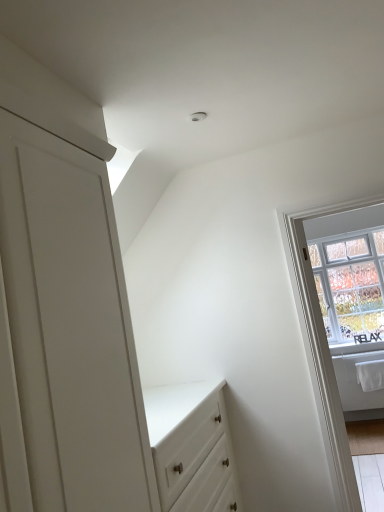
Question: Considering the relative sizes of white plastic window frame at right and clear glass window at upper right in the image provided, is white plastic window frame at right bigger than clear glass window at upper right?

Choices:
 (A) yes
 (B) no

Answer: (B)

Question: Considering the relative positions of white plastic window frame at right and clear glass window at upper right in the image provided, is white plastic window frame at right in front of clear glass window at upper right?

Choices:
 (A) no
 (B) yes

Answer: (B)

Question: Considering the relative sizes of white plastic window frame at right and clear glass window at upper right in the image provided, is white plastic window frame at right taller than clear glass window at upper right?

Choices:
 (A) yes
 (B) no

Answer: (A)

Question: Does white plastic window frame at right have a greater width compared to clear glass window at upper right?

Choices:
 (A) yes
 (B) no

Answer: (B)

Question: Is white plastic window frame at right to the left of clear glass window at upper right from the viewer's perspective?

Choices:
 (A) yes
 (B) no

Answer: (A)

Question: From a real-world perspective, is white plastic window frame at right on top of clear glass window at upper right?

Choices:
 (A) yes
 (B) no

Answer: (B)

Question: From a real-world perspective, is clear glass window at upper right positioned under white plastic window frame at right based on gravity?

Choices:
 (A) no
 (B) yes

Answer: (A)

Question: Considering the relative sizes of clear glass window at upper right and white plastic window frame at right in the image provided, is clear glass window at upper right smaller than white plastic window frame at right?

Choices:
 (A) no
 (B) yes

Answer: (A)

Question: From a real-world perspective, does clear glass window at upper right stand above white plastic window frame at right?

Choices:
 (A) yes
 (B) no

Answer: (A)

Question: Does clear glass window at upper right have a greater height compared to white plastic window frame at right?

Choices:
 (A) yes
 (B) no

Answer: (B)

Question: From the image's perspective, does clear glass window at upper right appear higher than white plastic window frame at right?

Choices:
 (A) no
 (B) yes

Answer: (B)

Question: Is clear glass window at upper right positioned with its back to white plastic window frame at right?

Choices:
 (A) no
 (B) yes

Answer: (A)

Question: Does point (326, 428) appear closer or farther from the camera than point (377, 337)?

Choices:
 (A) farther
 (B) closer

Answer: (B)